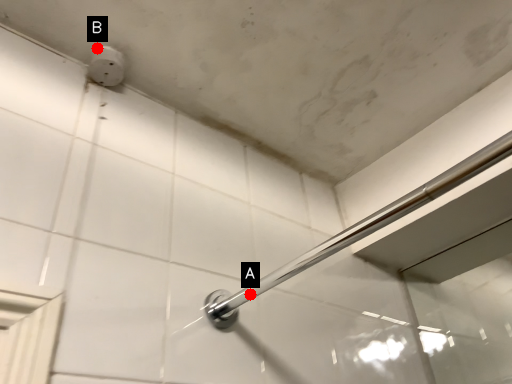
Question: Two points are circled on the image, labeled by A and B beside each circle. Which point is further to the camera?

Choices:
 (A) A is further
 (B) B is further

Answer: (B)